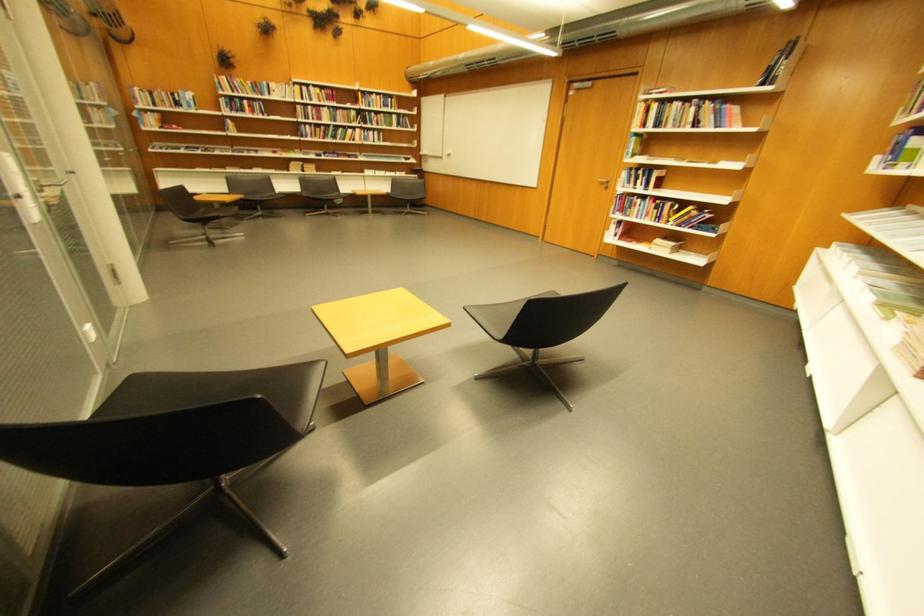
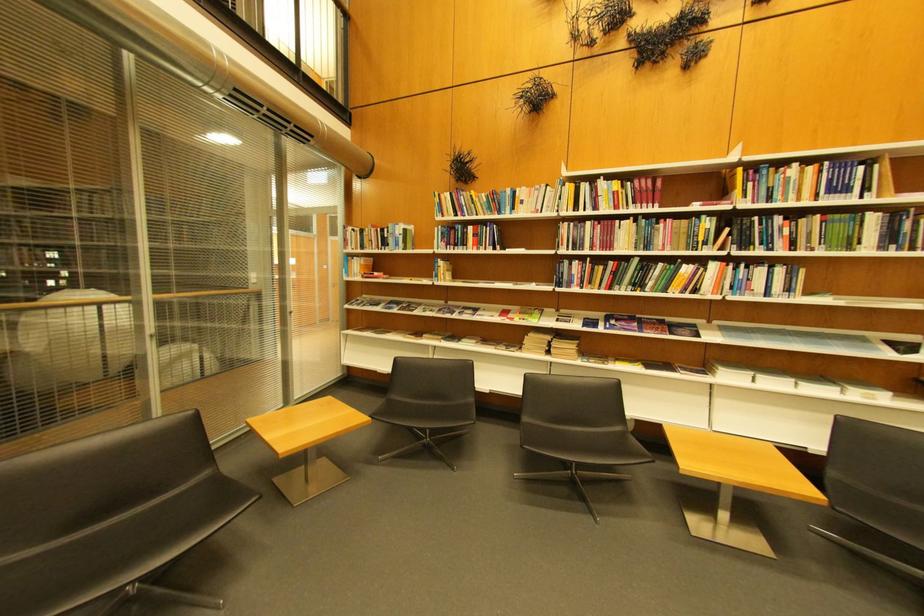
Find the pixel in the second image that matches point (320, 108) in the first image.

(600, 225)